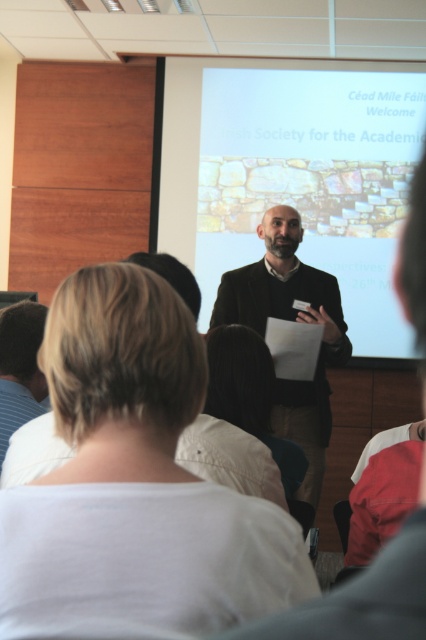
Question: Which point appears closest to the camera in this image?

Choices:
 (A) (31, 371)
 (B) (282, 404)
 (C) (164, 412)
 (D) (394, 193)

Answer: (C)

Question: Is white cotton shirt at center positioned at the back of dark brown hair at lower left?

Choices:
 (A) no
 (B) yes

Answer: (A)

Question: Which point is farther to the camera?

Choices:
 (A) white cotton shirt at center
 (B) matte stone wall at center

Answer: (B)

Question: Which point is closer to the camera taking this photo?

Choices:
 (A) [x=8, y=342]
 (B) [x=394, y=342]
 (C) [x=181, y=381]
 (D) [x=298, y=292]

Answer: (C)

Question: Is matte stone wall at center below dark brown hair at lower left?

Choices:
 (A) yes
 (B) no

Answer: (B)

Question: Is matte stone wall at center closer to the viewer compared to dark brown hair at lower left?

Choices:
 (A) yes
 (B) no

Answer: (B)